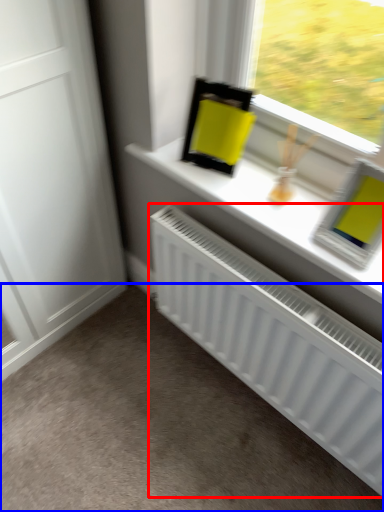
Question: Which point is closer to the camera, radiator (highlighted by a red box) or plain (highlighted by a blue box)?

Choices:
 (A) radiator
 (B) plain

Answer: (A)